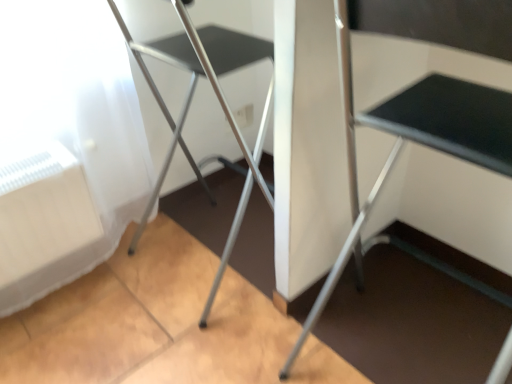
The image size is (512, 384). Describe the element at coordinates (195, 87) in the screenshot. I see `metallic silver chair at left` at that location.

At what (x,y) coordinates should I click in order to perform the action: click on metallic silver chair at left. Please return your answer as a coordinate pair (x, y). The height and width of the screenshot is (384, 512). Looking at the image, I should click on (195, 87).

In order to face metallic silver chair at left, should I rotate leftwards or rightwards?

It's best to rotate left around 8.328 degrees.

Identify the location of silver metallic folding table at center. The image size is (512, 384). (413, 141).

What do you see at coordinates (413, 141) in the screenshot? The height and width of the screenshot is (384, 512). I see `silver metallic folding table at center` at bounding box center [413, 141].

You are a GUI agent. You are given a task and a screenshot of the screen. Output one action in this format:
    pyautogui.click(x=<x>, y=<y>)
    Task: Click on the metallic silver chair at left
    The height and width of the screenshot is (384, 512).
    Given the screenshot: What is the action you would take?
    pyautogui.click(x=195, y=87)

Is metallic silver chair at left to the left or to the right of silver metallic folding table at center in the image?

Result: metallic silver chair at left is positioned on silver metallic folding table at center's left side.

Is metallic silver chair at left closer to the viewer compared to silver metallic folding table at center?

No, the depth of metallic silver chair at left is greater than that of silver metallic folding table at center.

Which is behind, point (132, 40) or point (473, 102)?

The point (132, 40) is farther.

From the image's perspective, who appears lower, metallic silver chair at left or silver metallic folding table at center?

silver metallic folding table at center is shown below in the image.

From a real-world perspective, which object stands above the other?

In real-world perspective, silver metallic folding table at center is above.

Considering the sizes of metallic silver chair at left and silver metallic folding table at center in the image, is metallic silver chair at left wider or thinner than silver metallic folding table at center?

Clearly, metallic silver chair at left has less width compared to silver metallic folding table at center.

Which of these two, metallic silver chair at left or silver metallic folding table at center, stands shorter?

Standing shorter between the two is metallic silver chair at left.

Who is smaller, metallic silver chair at left or silver metallic folding table at center?

With smaller size is metallic silver chair at left.

Looking at this image, do you think metallic silver chair at left is within silver metallic folding table at center, or outside of it?

metallic silver chair at left is spatially situated outside silver metallic folding table at center.

Is metallic silver chair at left directly adjacent to silver metallic folding table at center?

No, metallic silver chair at left is not making contact with silver metallic folding table at center.

Is metallic silver chair at left facing away from silver metallic folding table at center?

No, silver metallic folding table at center is not at the back of metallic silver chair at left.

I want to click on furniture in front of the metallic silver chair at left, so click(x=413, y=141).

Which object is positioned more to the left, silver metallic folding table at center or metallic silver chair at left?

From the viewer's perspective, metallic silver chair at left appears more on the left side.

In the scene shown: Does silver metallic folding table at center lie in front of metallic silver chair at left?

Yes, silver metallic folding table at center is closer to the viewer.

Which is closer, (380, 186) or (217, 75)?

Point (380, 186) is positioned farther from the camera compared to point (217, 75).

From the image's perspective, is silver metallic folding table at center over metallic silver chair at left?

No, from the image's perspective, silver metallic folding table at center is not over metallic silver chair at left.

From a real-world perspective, who is located lower, silver metallic folding table at center or metallic silver chair at left?

metallic silver chair at left, from a real-world perspective.

Which of these two, silver metallic folding table at center or metallic silver chair at left, is thinner?

With smaller width is metallic silver chair at left.

Considering the sizes of silver metallic folding table at center and metallic silver chair at left in the image, is silver metallic folding table at center taller or shorter than metallic silver chair at left?

Considering their sizes, silver metallic folding table at center has more height than metallic silver chair at left.

Between silver metallic folding table at center and metallic silver chair at left, which one has smaller size?

metallic silver chair at left is smaller.

Based on the photo, is silver metallic folding table at center surrounding metallic silver chair at left?

No, metallic silver chair at left is not inside silver metallic folding table at center.

Are silver metallic folding table at center and metallic silver chair at left making contact?

No.

Based on the photo, could you tell me if silver metallic folding table at center is facing metallic silver chair at left?

No, silver metallic folding table at center does not turn towards metallic silver chair at left.

How different are the orientations of silver metallic folding table at center and metallic silver chair at left in degrees?

They differ by 1.48e-05 degrees in their facing directions.

Where is `chair that is under the silver metallic folding table at center (from a real-world perspective)`? This screenshot has height=384, width=512. chair that is under the silver metallic folding table at center (from a real-world perspective) is located at coordinates (195, 87).

Locate an element on the screen. This screenshot has width=512, height=384. furniture lying in front of the metallic silver chair at left is located at coordinates (413, 141).

Where is `chair behind the silver metallic folding table at center`? chair behind the silver metallic folding table at center is located at coordinates (195, 87).